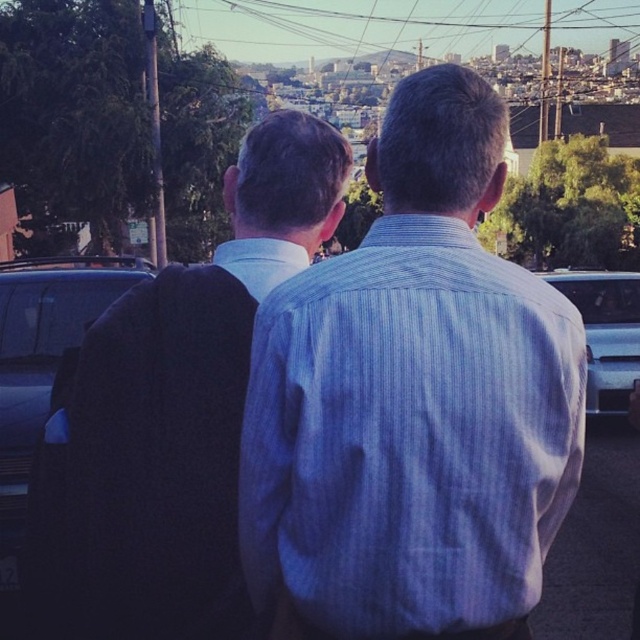
You are standing in the scene and want to take a photo of the point at coordinates (x=314, y=237). The camera you are using has a focal length of 50mm and a sensor size of 24mm. What is the minimum distance you need to move forward to ensure the point fills the frame vertically?

The point at coordinates (x=314, y=237) is 3.11 meters away from the camera. To calculate the minimum distance needed to move forward, use the formula distance_new_distance_old multiplied by sensor size divided by focal length. Plugging in the values, the new distance should be 3.11 meters multiplied by 24mm divided by 50mm, resulting in approximately 1.51 meters. Therefore, you need to move forward to 1.51 meters away from the point to fill the frame vertically.

You are a delivery person who needs to park your 5.5 meter long truck between the blue striped shirt at center and the shiny black car at left. Can you fit your truck in that space?

The distance between the blue striped shirt at center and the shiny black car at left is 6.60 meters. Since your truck is 5.5 meters long, there is enough space to park it between them.